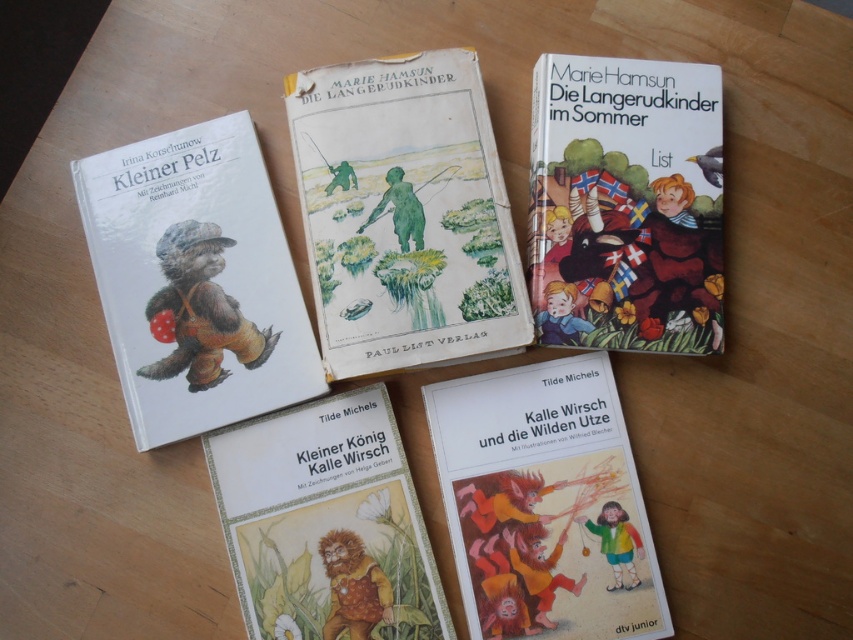
Does hardcover book at upper right appear on the right side of matte paper book at lower center?

Yes, hardcover book at upper right is to the right of matte paper book at lower center.

Is hardcover book at upper right behind matte paper book at lower center?

Yes.

Locate an element on the screen. The height and width of the screenshot is (640, 853). hardcover book at upper right is located at coordinates (625, 204).

Identify the location of hardcover book at upper right. (625, 204).

Identify the location of matte paper book at lower center. (544, 502).

Does matte paper book at lower center have a greater width compared to brown paper cover at center?

No.

Identify the location of matte paper book at lower center. This screenshot has width=853, height=640. (544, 502).

Does hardcover book at upper right come in front of brown paper cover at center?

No, it is not.

Can you confirm if hardcover book at upper right is smaller than brown paper cover at center?

Correct, hardcover book at upper right occupies less space than brown paper cover at center.

Is point (599, 180) closer to camera compared to point (271, 516)?

That is False.

Identify the location of hardcover book at upper right. This screenshot has height=640, width=853. (625, 204).